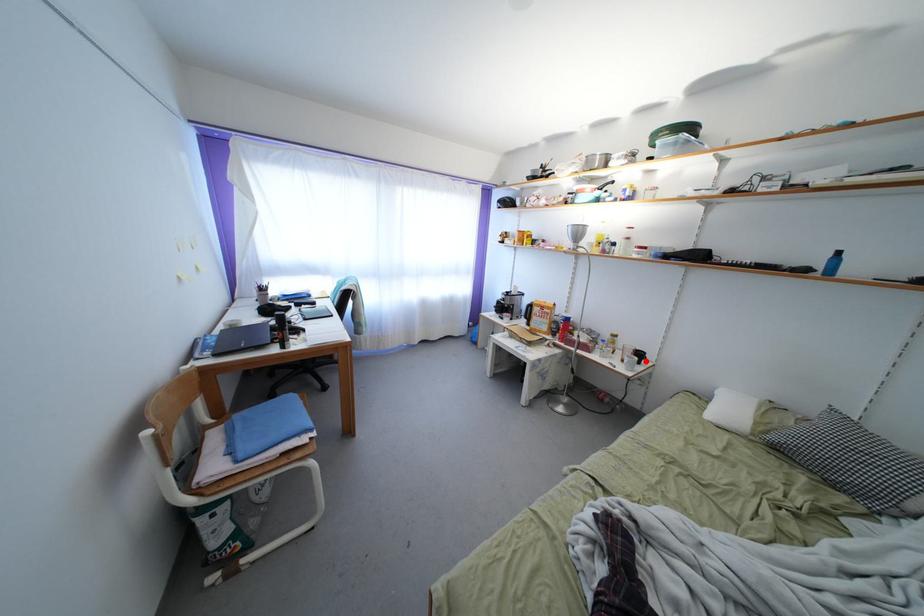
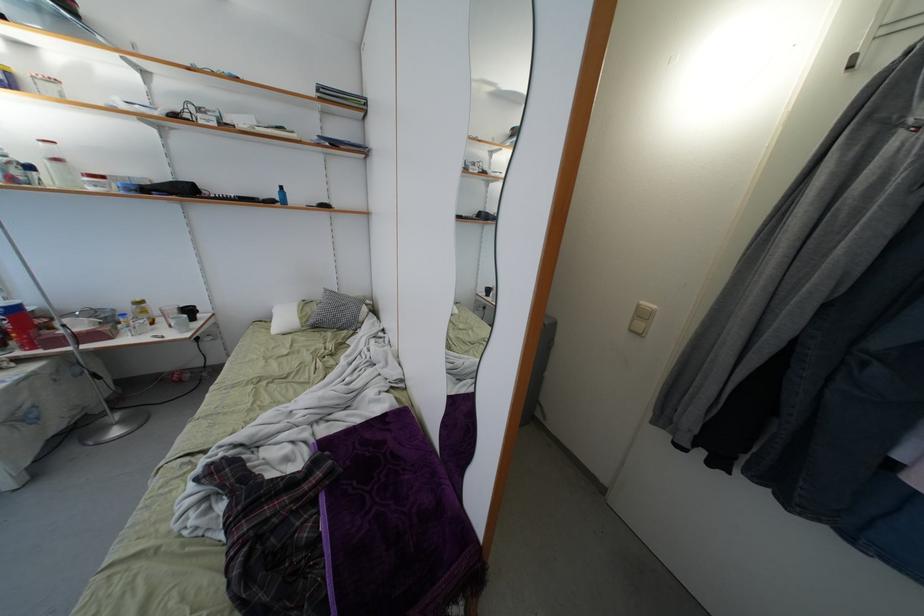
In the second image, find the point that corresponds to the highlighted location in the first image.

(195, 315)